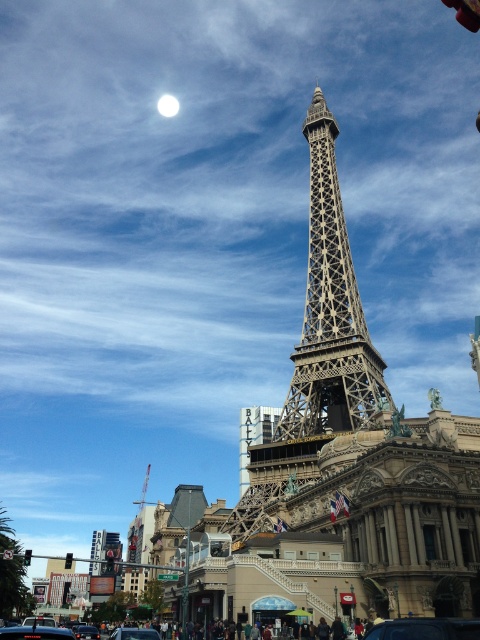
Is point (335, 364) more distant than point (166, 93)?

No.

The height and width of the screenshot is (640, 480). In order to click on metallic structure at center in this screenshot , I will do `click(330, 308)`.

Find the location of a particular element. This screenshot has width=480, height=640. metallic structure at center is located at coordinates (330, 308).

Can you confirm if metallic silver car at center is positioned to the right of white glossy moon at upper center?

Yes, metallic silver car at center is to the right of white glossy moon at upper center.

Is metallic silver car at center positioned behind white glossy moon at upper center?

No, metallic silver car at center is in front of white glossy moon at upper center.

Which is in front, point (132, 636) or point (160, 99)?

Point (132, 636)

Identify the location of metallic silver car at center. (133, 634).

Is point (343, 276) positioned behind point (80, 632)?

Yes.

Can you confirm if metallic structure at center is positioned to the left of black glossy car at center?

No, metallic structure at center is not to the left of black glossy car at center.

Does point (312, 416) come farther from viewer compared to point (90, 634)?

No, (312, 416) is in front of (90, 634).

The height and width of the screenshot is (640, 480). I want to click on metallic structure at center, so click(330, 308).